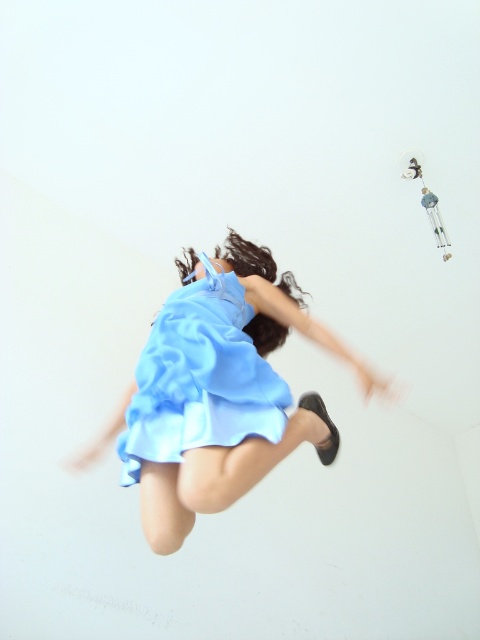
Is point (210, 467) closer to camera compared to point (143, 426)?

Yes, it is in front of point (143, 426).

This screenshot has height=640, width=480. What do you see at coordinates (218, 392) in the screenshot?
I see `light blue fabric dress at center` at bounding box center [218, 392].

Identify the location of light blue fabric dress at center. The width and height of the screenshot is (480, 640). [x=218, y=392].